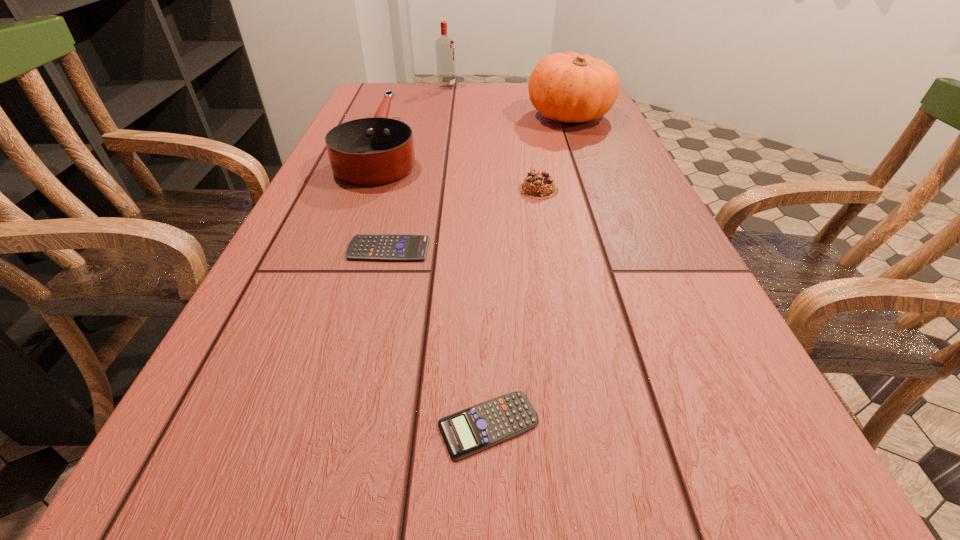
Where is `vacant space that's between the nearer calculator and the farther calculator`? Image resolution: width=960 pixels, height=540 pixels. vacant space that's between the nearer calculator and the farther calculator is located at coordinates (439, 337).

This screenshot has height=540, width=960. Find the location of `free point between the fourth shortest object and the pumpkin`. free point between the fourth shortest object and the pumpkin is located at coordinates (475, 132).

I want to click on vacant point located between the left calculator and the third shortest object, so click(464, 219).

I want to click on vacant space in between the second nearest object and the nearer calculator, so click(x=439, y=337).

Locate an element on the screen. free area in between the tallest object and the fourth shortest object is located at coordinates (415, 117).

Find the location of a particular element. This screenshot has width=960, height=540. blank region between the nearest object and the chocolate cake is located at coordinates (514, 307).

Choose which object is the fourth nearest neighbor to the fourth shortest object. Please provide its 2D coordinates. Your answer should be formatted as a tuple, i.e. [(x, y)], where the tuple contains the x and y coordinates of a point satisfying the conditions above.

[(568, 87)]

At what (x,y) coordinates should I click in order to perform the action: click on object identified as the closest to the fifth farthest object. Please return your answer as a coordinate pair (x, y). The width and height of the screenshot is (960, 540). Looking at the image, I should click on (371, 151).

Identify the location of free location that satisfies the following two spatial constraints: 1. on the front label of the third shortest object; 2. on the right side of the vodka. (430, 189).

Locate an element on the screen. vacant space that satisfies the following two spatial constraints: 1. on the back side of the nearest object; 2. on the left side of the second tallest object is located at coordinates (484, 116).